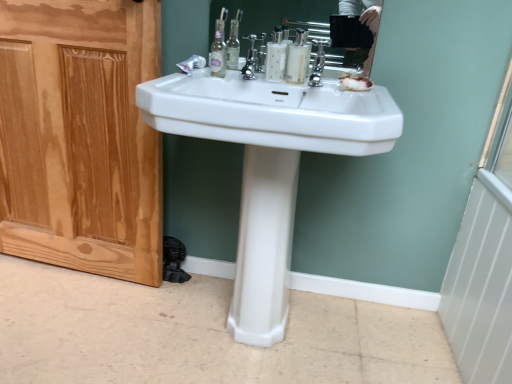
Find the location of a particular element. The width and height of the screenshot is (512, 384). free spot to the right of white glossy pedestal at center is located at coordinates [x=320, y=330].